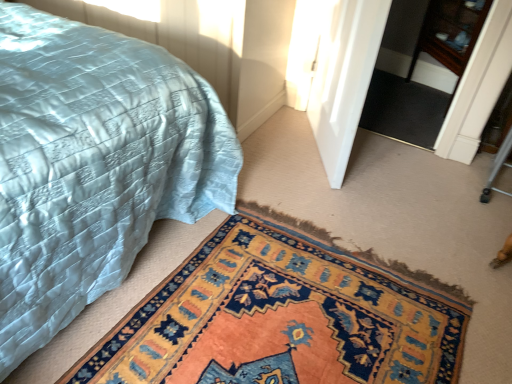
Question: Considering the relative sizes of carpeted mat at lower center and matte blue quilt at lower left in the image provided, is carpeted mat at lower center bigger than matte blue quilt at lower left?

Choices:
 (A) yes
 (B) no

Answer: (B)

Question: Is carpeted mat at lower center facing towards matte blue quilt at lower left?

Choices:
 (A) yes
 (B) no

Answer: (B)

Question: From the image's perspective, is carpeted mat at lower center under matte blue quilt at lower left?

Choices:
 (A) no
 (B) yes

Answer: (B)

Question: Considering the relative sizes of carpeted mat at lower center and matte blue quilt at lower left in the image provided, is carpeted mat at lower center wider than matte blue quilt at lower left?

Choices:
 (A) yes
 (B) no

Answer: (B)

Question: Are carpeted mat at lower center and matte blue quilt at lower left beside each other?

Choices:
 (A) no
 (B) yes

Answer: (A)

Question: Is black carpet at center taller or shorter than wooden dresser at upper right?

Choices:
 (A) tall
 (B) short

Answer: (B)

Question: Does point (367, 112) appear closer or farther from the camera than point (437, 87)?

Choices:
 (A) closer
 (B) farther

Answer: (A)

Question: From a real-world perspective, is black carpet at center above or below wooden dresser at upper right?

Choices:
 (A) above
 (B) below

Answer: (B)

Question: Which is correct: black carpet at center is inside wooden dresser at upper right, or outside of it?

Choices:
 (A) inside
 (B) outside

Answer: (B)

Question: From the image's perspective, is wooden dresser at upper right above or below white glossy door at center?

Choices:
 (A) above
 (B) below

Answer: (A)

Question: Visually, is wooden dresser at upper right positioned to the left or to the right of white glossy door at center?

Choices:
 (A) right
 (B) left

Answer: (A)

Question: Considering the positions of point (426, 49) and point (338, 16), is point (426, 49) closer or farther from the camera than point (338, 16)?

Choices:
 (A) farther
 (B) closer

Answer: (A)

Question: From their relative heights in the image, would you say wooden dresser at upper right is taller or shorter than white glossy door at center?

Choices:
 (A) tall
 (B) short

Answer: (B)

Question: In the image, is matte blue quilt at lower left on the left side or the right side of wooden dresser at upper right?

Choices:
 (A) left
 (B) right

Answer: (A)

Question: Based on their sizes in the image, would you say matte blue quilt at lower left is bigger or smaller than wooden dresser at upper right?

Choices:
 (A) small
 (B) big

Answer: (B)